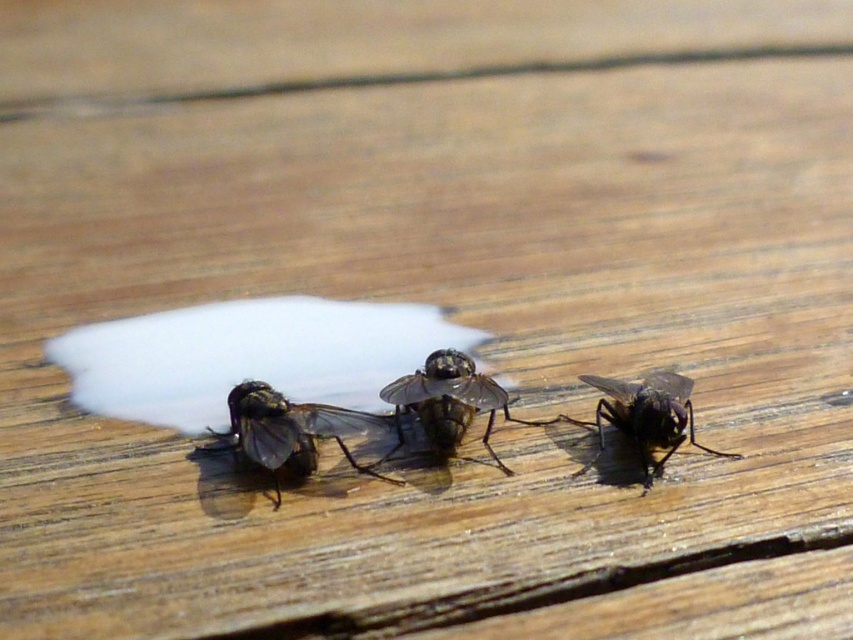
Is translucent dark at center bigger than black glossy fly at center?

Yes.

Does translucent dark at center appear over black glossy fly at center?

No, translucent dark at center is not above black glossy fly at center.

Locate an element on the screen. The width and height of the screenshot is (853, 640). translucent dark at center is located at coordinates (287, 432).

Who is taller, shiny black fly at center or black glossy fly at center?

shiny black fly at center is taller.

At what (x,y) coordinates should I click in order to perform the action: click on shiny black fly at center. Please return your answer as a coordinate pair (x, y). Image resolution: width=853 pixels, height=640 pixels. Looking at the image, I should click on (448, 401).

Where is `shiny black fly at center`? shiny black fly at center is located at coordinates (448, 401).

Which is more to the right, translucent dark at center or shiny black fly at center?

shiny black fly at center is more to the right.

Based on the photo, does translucent dark at center have a lesser height compared to shiny black fly at center?

Yes.

The image size is (853, 640). What do you see at coordinates (287, 432) in the screenshot?
I see `translucent dark at center` at bounding box center [287, 432].

Locate an element on the screen. translucent dark at center is located at coordinates (287, 432).